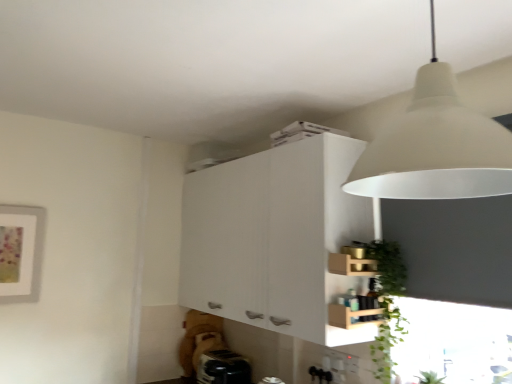
Question: Is black plastic toaster at lower center wider than white matte cabinet at upper center?

Choices:
 (A) yes
 (B) no

Answer: (B)

Question: Can you confirm if black plastic toaster at lower center is smaller than white matte cabinet at upper center?

Choices:
 (A) no
 (B) yes

Answer: (B)

Question: From a real-world perspective, is black plastic toaster at lower center physically above white matte cabinet at upper center?

Choices:
 (A) yes
 (B) no

Answer: (B)

Question: Is black plastic toaster at lower center in front of white matte cabinet at upper center?

Choices:
 (A) no
 (B) yes

Answer: (A)

Question: Is black plastic toaster at lower center completely or partially outside of white matte cabinet at upper center?

Choices:
 (A) no
 (B) yes

Answer: (B)

Question: Is black plastic toaster at lower center positioned with its back to white matte cabinet at upper center?

Choices:
 (A) no
 (B) yes

Answer: (A)

Question: Is black plastic toaster at lower center far from white matte lampshade at upper right?

Choices:
 (A) no
 (B) yes

Answer: (B)

Question: Is black plastic toaster at lower center beside white matte lampshade at upper right?

Choices:
 (A) yes
 (B) no

Answer: (B)

Question: Is black plastic toaster at lower center shorter than white matte lampshade at upper right?

Choices:
 (A) yes
 (B) no

Answer: (A)

Question: From the image's perspective, is black plastic toaster at lower center located beneath white matte lampshade at upper right?

Choices:
 (A) no
 (B) yes

Answer: (B)

Question: Would you say black plastic toaster at lower center is outside white matte lampshade at upper right?

Choices:
 (A) yes
 (B) no

Answer: (A)

Question: Is black plastic toaster at lower center at the left side of white matte lampshade at upper right?

Choices:
 (A) no
 (B) yes

Answer: (B)

Question: Is green leafy plant at lower right bigger than wooden crate at lower right?

Choices:
 (A) no
 (B) yes

Answer: (B)